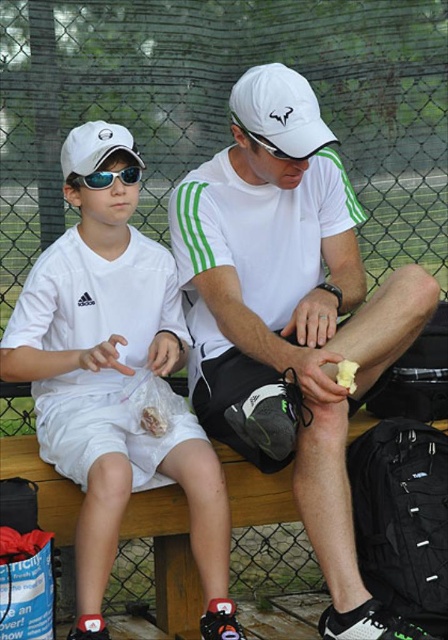
You are a photographer trying to capture a photo of the matte black goggles at left and the camera. The minimum distance required for both objects to be in focus is 8 feet. Can you take the photo without moving either object?

The matte black goggles at left and camera are 8.02 feet apart, which exceeds the minimum required distance of 8 feet. Therefore, you can take the photo without moving either object as they are within the focus range.

Consider the image. You are a photographer taking a picture of the two people on the wooden bench. You want to focus on the white matte baseball cap at upper left. Where exactly is the point at coordinate (x=94, y=147) located on the cap?

The point at coordinate (x=94, y=147) is located on the white matte baseball cap at upper left.

You are a photographer trying to capture a closeup of the yellow butter at lower right without the white matte baseball cap at upper left blocking the view. Since you can only move sideways, can you adjust your position to avoid the cap?

The white matte baseball cap at upper left is wider than the yellow butter at lower right. Since you can only move sideways, you can adjust your position to avoid the cap as the butter is narrower and you can shift left or right to frame it without the cap obstructing.